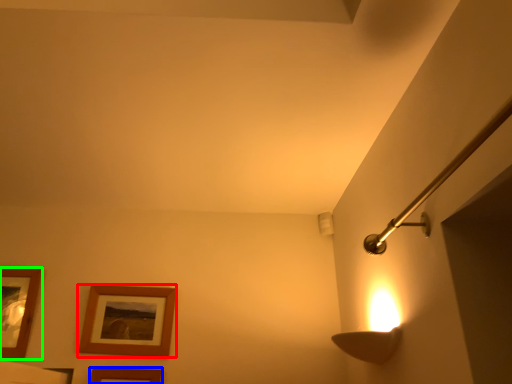
Question: Based on their relative distances, which object is farther from picture frame (highlighted by a red box)? Choose from picture frame (highlighted by a blue box) and picture frame (highlighted by a green box).

Choices:
 (A) picture frame
 (B) picture frame

Answer: (B)